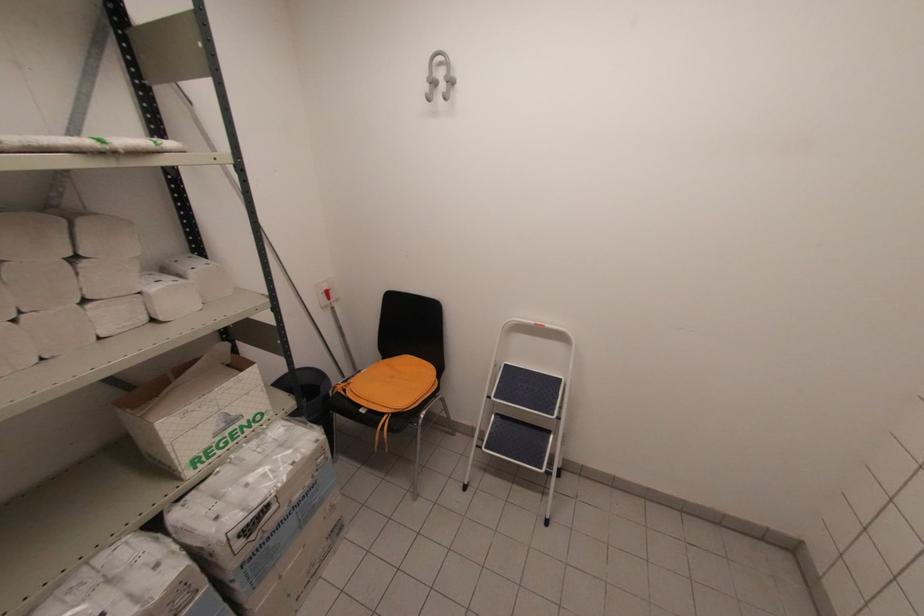
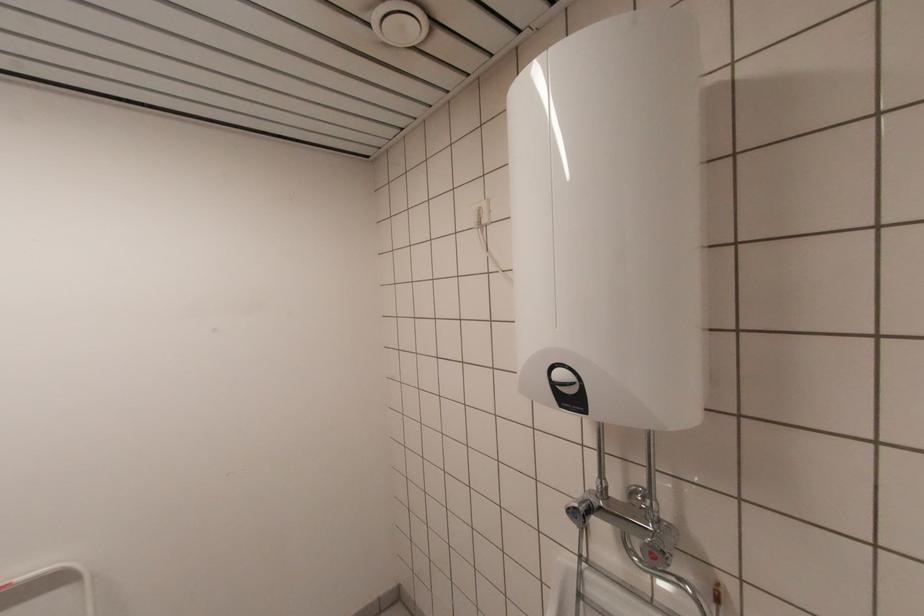
Question: The camera is either moving clockwise (left) or counter-clockwise (right) around the object. The first image is from the beginning of the video and the second image is from the end. Is the camera moving left or right when shooting the video?

Choices:
 (A) Left
 (B) Right

Answer: (A)